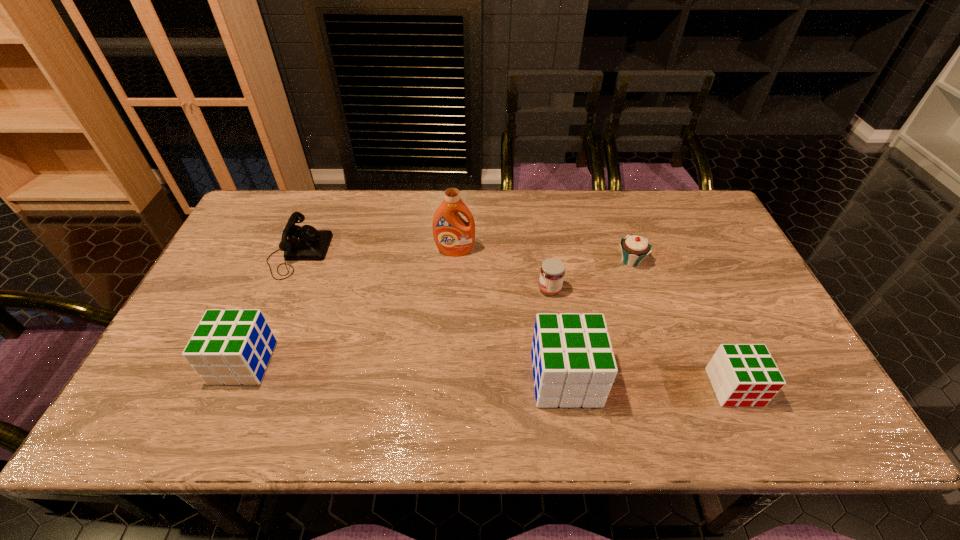
Locate an element on the screen. This screenshot has width=960, height=540. the leftmost cube is located at coordinates (233, 346).

At what (x,y) coordinates should I click in order to perform the action: click on the fifth shortest object. Please return your answer as a coordinate pair (x, y). Looking at the image, I should click on (233, 346).

This screenshot has width=960, height=540. Identify the location of the tallest cube. (573, 364).

The width and height of the screenshot is (960, 540). In order to click on the second tallest object in this screenshot , I will do `click(573, 364)`.

Locate an element on the screen. the rightmost object is located at coordinates (742, 375).

The height and width of the screenshot is (540, 960). I want to click on the shortest cube, so click(x=742, y=375).

You are a GUI agent. You are given a task and a screenshot of the screen. Output one action in this format:
    pyautogui.click(x=<x>, y=<y>)
    Task: Click on the telephone
    This screenshot has width=960, height=540.
    Given the screenshot: What is the action you would take?
    point(305,243)

Find the location of a particular element. The image size is (960, 540). the second object from right to left is located at coordinates (635, 248).

Locate an element on the screen. The height and width of the screenshot is (540, 960). the tallest object is located at coordinates (453, 236).

The height and width of the screenshot is (540, 960). Identify the location of detergent. coord(453,236).